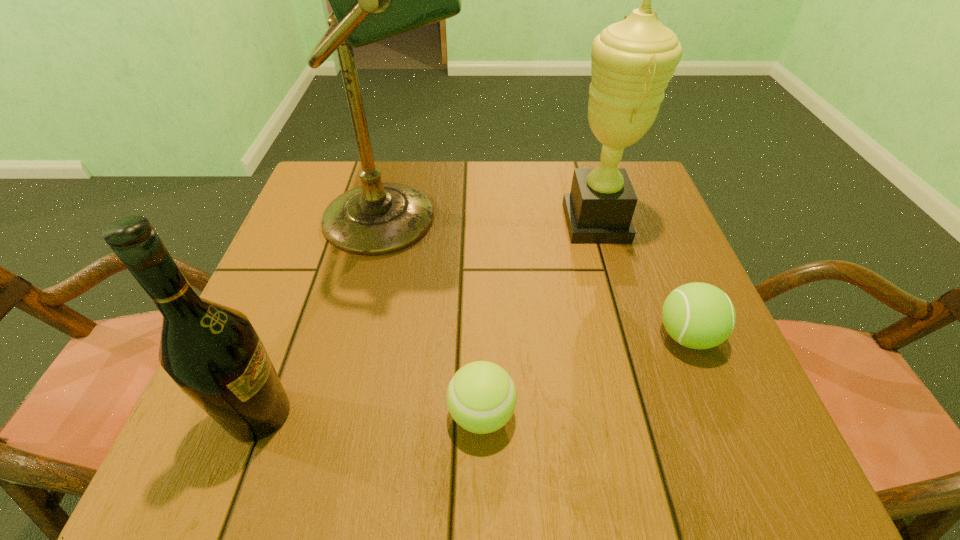
Image resolution: width=960 pixels, height=540 pixels. I want to click on vacant space at the far right corner of the desktop, so click(x=627, y=161).

Image resolution: width=960 pixels, height=540 pixels. In order to click on vacant area that lies between the right tennis ball and the nearer tennis ball in this screenshot , I will do `click(585, 375)`.

Identify the location of vacant region between the third shortest object and the table lamp. (328, 316).

Find the location of a particular element. The image size is (960, 540). vacant point located between the table lamp and the left tennis ball is located at coordinates (439, 316).

Where is `unoccupied area between the wine bottle and the fourth shortest object`? unoccupied area between the wine bottle and the fourth shortest object is located at coordinates (427, 319).

Find the location of a particular element. vacant point located between the table lamp and the third tallest object is located at coordinates (328, 316).

Where is `free area in between the third farthest object and the left tennis ball`? free area in between the third farthest object and the left tennis ball is located at coordinates (585, 375).

This screenshot has height=540, width=960. Identify the location of unoccupied position between the trophy cup and the nearer tennis ball. (539, 318).

Where is `empty space that is in between the wine bottle and the trophy cup`? This screenshot has height=540, width=960. empty space that is in between the wine bottle and the trophy cup is located at coordinates (427, 319).

Where is `vacant space that is in between the left tennis ball and the wine bottle`? vacant space that is in between the left tennis ball and the wine bottle is located at coordinates (371, 414).